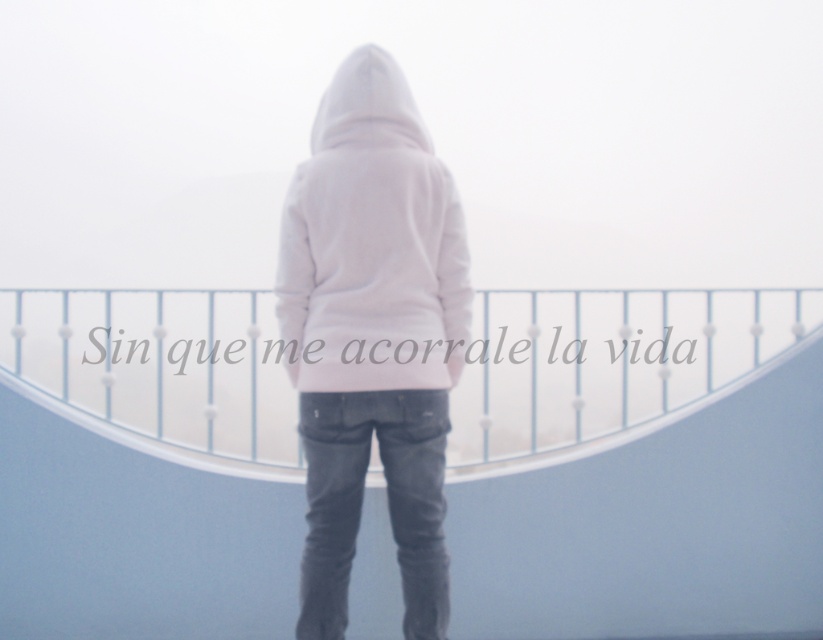
Does white plastic railing at center have a greater width compared to white fleece hoodie at center?

Indeed, white plastic railing at center has a greater width compared to white fleece hoodie at center.

Can you confirm if white plastic railing at center is smaller than white fleece hoodie at center?

Yes.

Does point (486, 394) come behind point (366, 141)?

Yes.

Find the location of a particular element. white plastic railing at center is located at coordinates (607, 360).

Does white plastic railing at center have a greater width compared to white matte hoodie at center?

Yes.

Find the location of a particular element. white plastic railing at center is located at coordinates (607, 360).

Locate an element on the screen. white plastic railing at center is located at coordinates (607, 360).

Is white fleece hoodie at center thinner than white matte hoodie at center?

No, white fleece hoodie at center is not thinner than white matte hoodie at center.

Does white fleece hoodie at center have a smaller size compared to white matte hoodie at center?

No.

I want to click on white fleece hoodie at center, so click(370, 244).

I want to click on white fleece hoodie at center, so click(370, 244).